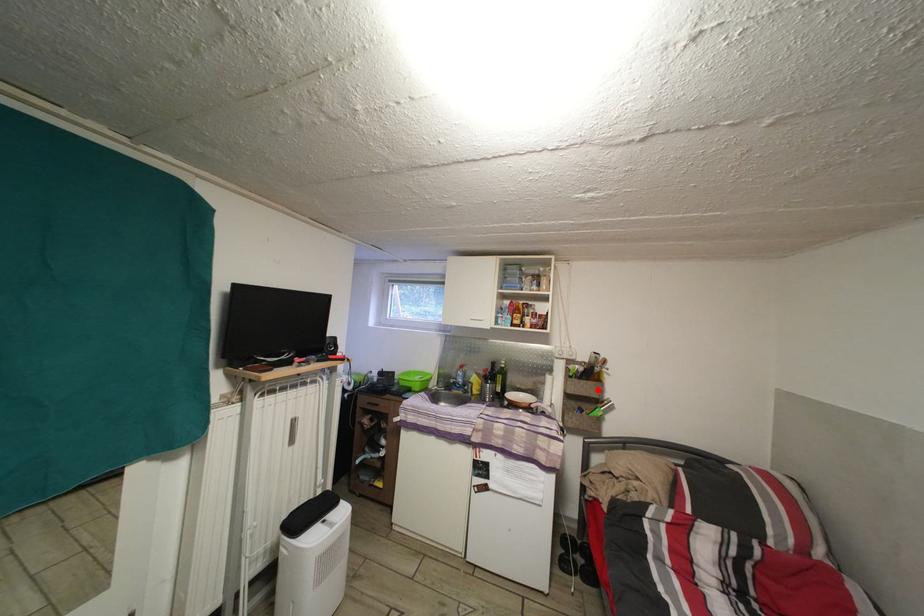
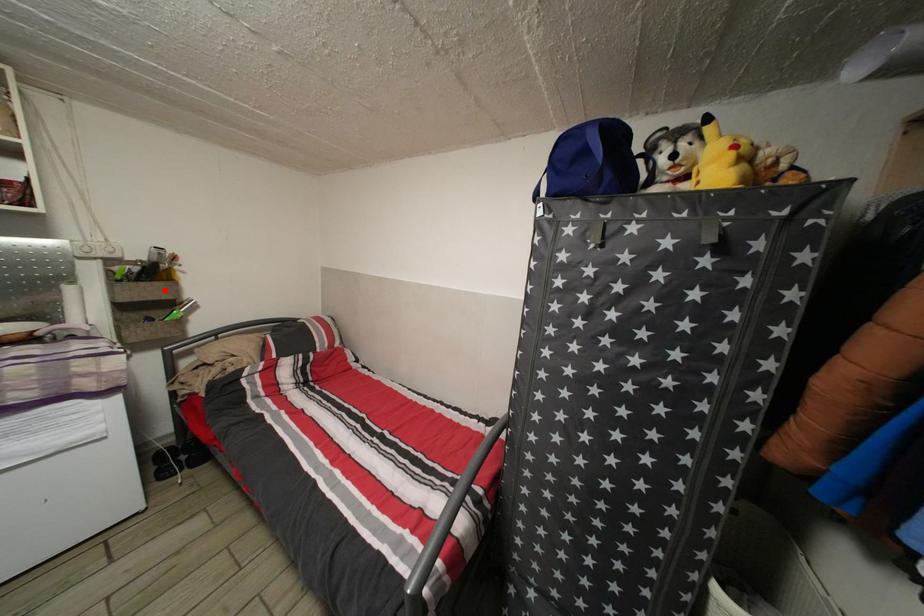
I am providing you with two images of the same scene from different viewpoints. A red point is marked on the first image and another point is marked on the second image. Are the points marked in image1 and image2 representing the same 3D position?

Yes